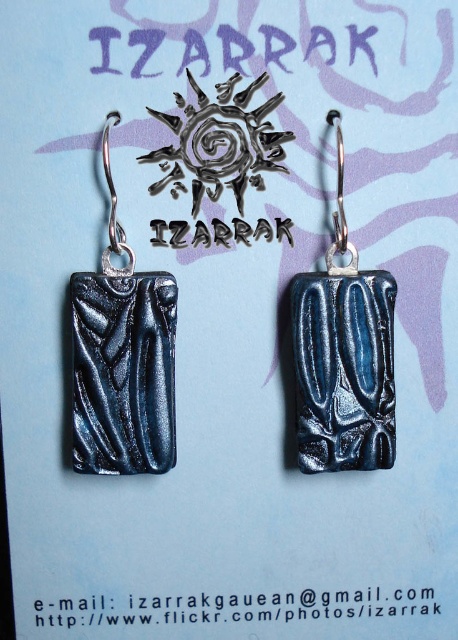
Question: Is metallic blue stone at center thinner than metallic blue rectangle at center?

Choices:
 (A) no
 (B) yes

Answer: (B)

Question: Which object appears closest to the camera in this image?

Choices:
 (A) metallic blue stone at center
 (B) metallic blue rectangle at center

Answer: (A)

Question: Can you confirm if metallic blue stone at center is wider than metallic blue rectangle at center?

Choices:
 (A) no
 (B) yes

Answer: (A)

Question: Is metallic blue stone at center positioned in front of metallic blue rectangle at center?

Choices:
 (A) no
 (B) yes

Answer: (B)

Question: Which point is farther to the camera?

Choices:
 (A) (369, 406)
 (B) (146, 308)

Answer: (A)